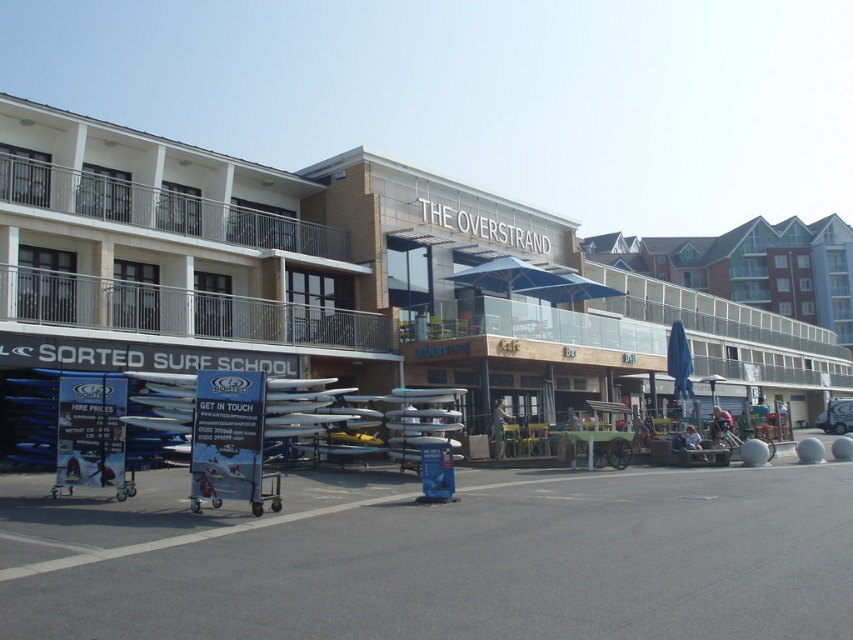
Question: Can you confirm if beige brick building at center is bigger than blue fabric umbrella at center?

Choices:
 (A) yes
 (B) no

Answer: (A)

Question: Which point is farther to the camera?

Choices:
 (A) beige brick building at center
 (B) blue fabric umbrella at center

Answer: (B)

Question: Among these objects, which one is farthest from the camera?

Choices:
 (A) blue fabric umbrella at center
 (B) beige brick building at center

Answer: (A)

Question: Which object appears farthest from the camera in this image?

Choices:
 (A) beige brick building at center
 (B) blue fabric umbrella at center

Answer: (B)

Question: Considering the relative positions of beige brick building at center and blue fabric umbrella at center in the image provided, where is beige brick building at center located with respect to blue fabric umbrella at center?

Choices:
 (A) right
 (B) left

Answer: (A)

Question: Is beige brick building at center to the left of blue fabric umbrella at center from the viewer's perspective?

Choices:
 (A) no
 (B) yes

Answer: (A)